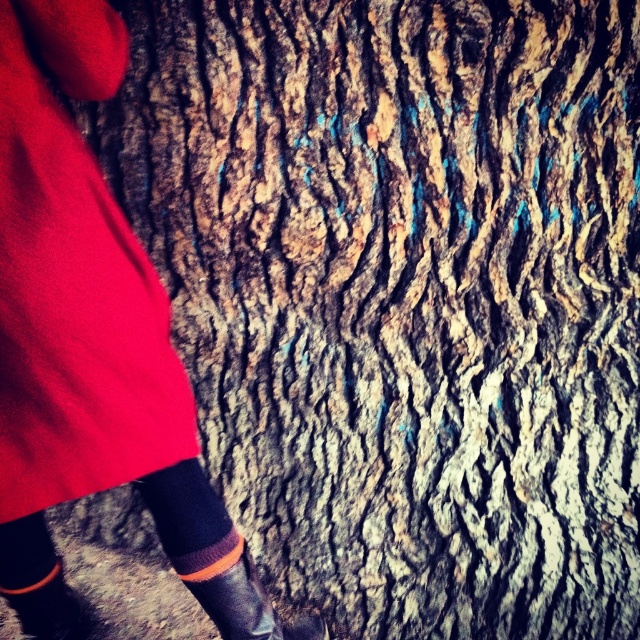
Does matte red fabric at left have a larger size compared to rubber boot at lower left?

Yes.

Does matte red fabric at left have a lesser width compared to rubber boot at lower left?

No.

Does point (65, 436) come closer to viewer compared to point (228, 598)?

Yes.

The image size is (640, 640). I want to click on matte red fabric at left, so click(74, 282).